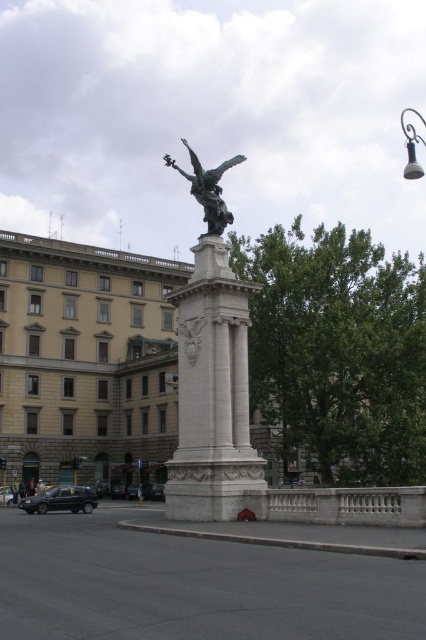
You are standing at the edge of the square holding a camera. You want to take a photo of the bronze statue at center. The camera requires you to be at least 40 meters away to capture the entire statue in one frame. Can you take the photo from your current position?

The bronze statue at center and camera are 38.80 meters apart. Since the minimum required distance is 40 meters, you are too close to capture the entire statue in one frame.

You are a photographer wanting to capture both the bronze statue at center and the shiny silver car at lower left in the same frame. Based on their sizes, do you think you can position yourself so that both are fully visible without cropping either?

The bronze statue at center might be wider than shiny silver car at lower left, so positioning yourself to include both might require careful framing to ensure the statue doesn not block or overshadow the car.